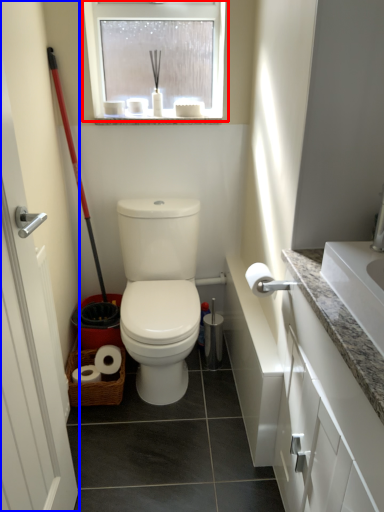
Question: Which of the following is the closest to the observer, window (highlighted by a red box) or screen door (highlighted by a blue box)?

Choices:
 (A) window
 (B) screen door

Answer: (B)